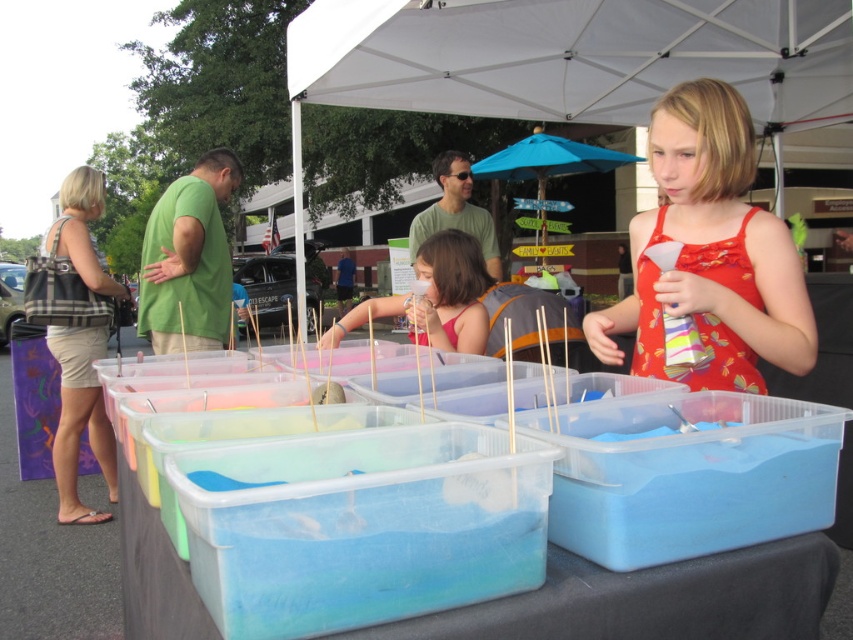
Question: Among these objects, which one is farthest from the camera?

Choices:
 (A) matte orange sundress at center
 (B) beige cotton shorts at left
 (C) matte pink dress at center
 (D) blue fabric umbrella at center

Answer: (D)

Question: Can you confirm if beige cotton shorts at left is positioned to the left of blue fabric umbrella at center?

Choices:
 (A) no
 (B) yes

Answer: (B)

Question: Estimate the real-world distances between objects in this image. Which object is closer to the beige cotton shorts at left?

Choices:
 (A) matte pink dress at center
 (B) matte orange sundress at center

Answer: (A)

Question: Is matte orange sundress at center below matte pink dress at center?

Choices:
 (A) no
 (B) yes

Answer: (A)

Question: Among these points, which one is nearest to the camera?

Choices:
 (A) (426, 240)
 (B) (51, 332)
 (C) (544, 164)
 (D) (730, 168)

Answer: (D)

Question: Is matte orange sundress at center wider than blue fabric umbrella at center?

Choices:
 (A) yes
 (B) no

Answer: (B)